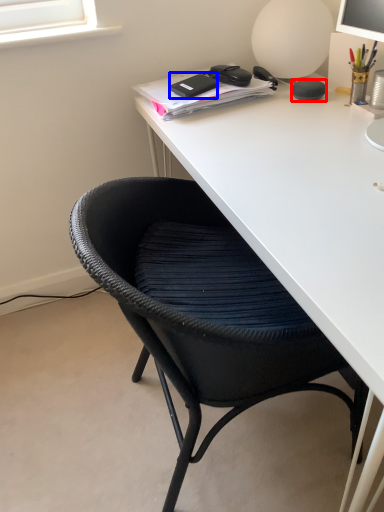
Question: Among these objects, which one is farthest to the camera, stationery (highlighted by a red box) or stationery (highlighted by a blue box)?

Choices:
 (A) stationery
 (B) stationery

Answer: (B)